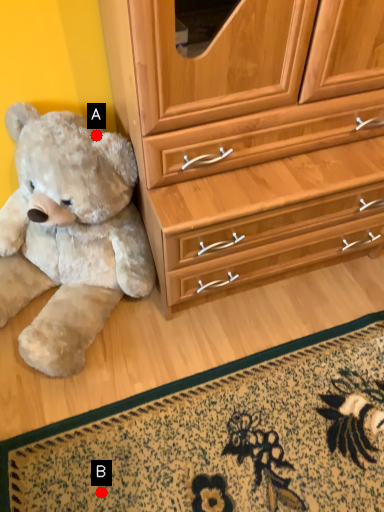
Question: Two points are circled on the image, labeled by A and B beside each circle. Which point is closer to the camera?

Choices:
 (A) A is closer
 (B) B is closer

Answer: (B)